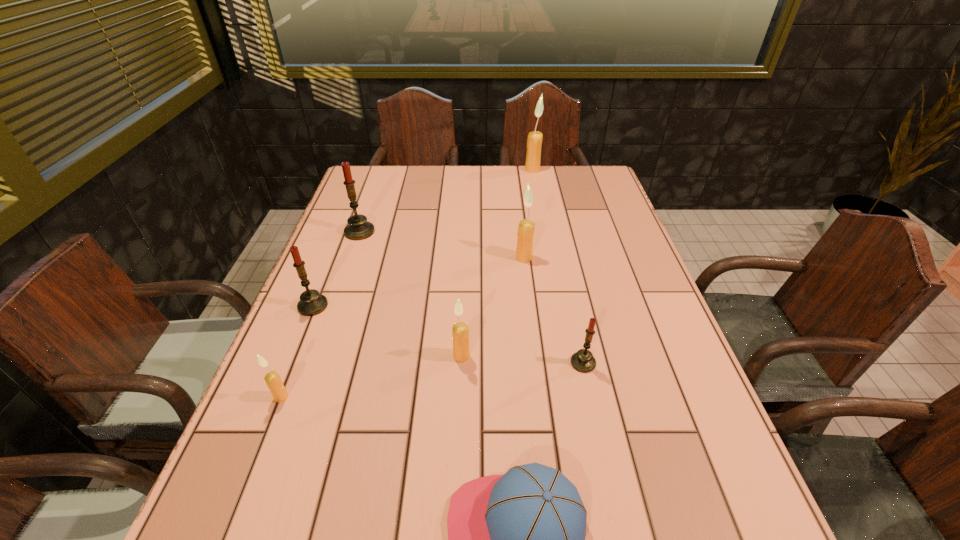
The height and width of the screenshot is (540, 960). Identify the location of the biggest cream candle. (533, 157).

Locate an element on the screen. Image resolution: width=960 pixels, height=540 pixels. the farthest cream candle is located at coordinates (533, 157).

Find the location of `the biggest red candle`. the biggest red candle is located at coordinates point(358,228).

At what (x,y) coordinates should I click in order to perform the action: click on the second farthest object. Please return your answer as a coordinate pair (x, y). The image size is (960, 540). Looking at the image, I should click on (358, 228).

This screenshot has height=540, width=960. What are the coordinates of `the fifth candle from left to right` in the screenshot? It's located at (525, 233).

Image resolution: width=960 pixels, height=540 pixels. Identify the location of the third smallest cream candle. (525, 233).

At what (x,y) coordinates should I click in order to perform the action: click on the second biggest red candle. Please return your answer as a coordinate pair (x, y). Looking at the image, I should click on (311, 303).

At what (x,y) coordinates should I click in order to perform the action: click on the fourth farthest object. Please return your answer as a coordinate pair (x, y). This screenshot has width=960, height=540. Looking at the image, I should click on (311, 303).

This screenshot has width=960, height=540. Identify the location of the fourth candle from right to left. (460, 331).

You are a GUI agent. You are given a task and a screenshot of the screen. Output one action in this format:
    pyautogui.click(x=<x>, y=<y>)
    Task: Click on the second nearest cream candle
    This screenshot has height=540, width=960.
    Given the screenshot: What is the action you would take?
    pyautogui.click(x=460, y=331)